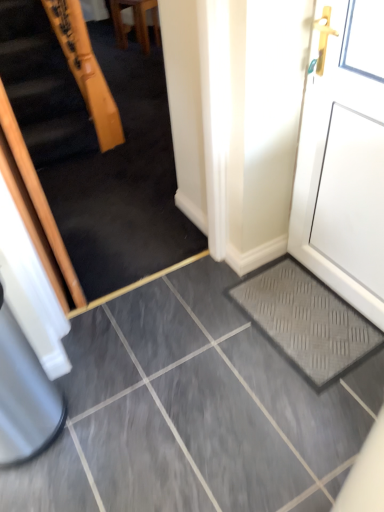
Question: From the image's perspective, would you say white matte door at right is positioned over grey rubber doormat at lower right?

Choices:
 (A) no
 (B) yes

Answer: (B)

Question: Is white matte door at right looking in the opposite direction of grey rubber doormat at lower right?

Choices:
 (A) no
 (B) yes

Answer: (A)

Question: From a real-world perspective, is white matte door at right under grey rubber doormat at lower right?

Choices:
 (A) no
 (B) yes

Answer: (A)

Question: Is white matte door at right thinner than grey rubber doormat at lower right?

Choices:
 (A) no
 (B) yes

Answer: (B)

Question: Is white matte door at right positioned behind grey rubber doormat at lower right?

Choices:
 (A) no
 (B) yes

Answer: (A)

Question: Visually, is wooden chair at upper center positioned to the left or to the right of white matte door at right?

Choices:
 (A) right
 (B) left

Answer: (B)

Question: From the image's perspective, is wooden chair at upper center positioned above or below white matte door at right?

Choices:
 (A) above
 (B) below

Answer: (A)

Question: Considering their positions, is wooden chair at upper center located in front of or behind white matte door at right?

Choices:
 (A) front
 (B) behind

Answer: (B)

Question: Is point (153, 32) positioned closer to the camera than point (342, 256)?

Choices:
 (A) farther
 (B) closer

Answer: (A)

Question: In terms of size, does wooden chair at upper center appear bigger or smaller than wooden handrail at upper left?

Choices:
 (A) small
 (B) big

Answer: (A)

Question: Looking at their shapes, would you say wooden chair at upper center is wider or thinner than wooden handrail at upper left?

Choices:
 (A) wide
 (B) thin

Answer: (A)

Question: Would you say wooden chair at upper center is inside or outside wooden handrail at upper left?

Choices:
 (A) outside
 (B) inside

Answer: (A)

Question: From a real-world perspective, is wooden chair at upper center physically located above or below wooden handrail at upper left?

Choices:
 (A) below
 (B) above

Answer: (A)

Question: Considering the positions of white matte door at right and wooden handrail at upper left in the image, is white matte door at right taller or shorter than wooden handrail at upper left?

Choices:
 (A) tall
 (B) short

Answer: (B)

Question: Considering the positions of point (339, 232) and point (104, 205), is point (339, 232) closer or farther from the camera than point (104, 205)?

Choices:
 (A) farther
 (B) closer

Answer: (B)